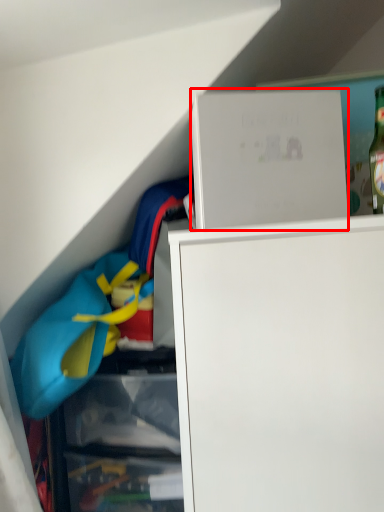
Question: Considering the relative positions of cabinet (annotated by the red box) and clothing in the image provided, where is cabinet (annotated by the red box) located with respect to the staircase?

Choices:
 (A) left
 (B) right

Answer: (B)